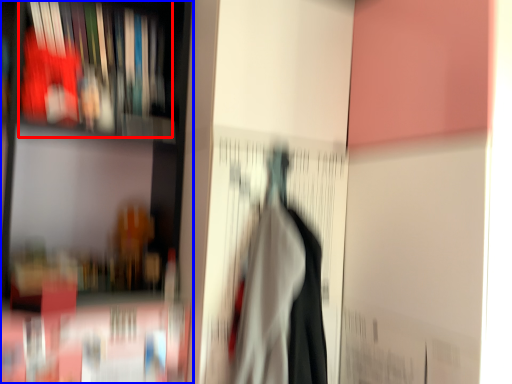
Question: Which point is further to the camera, book (highlighted by a red box) or shelf (highlighted by a blue box)?

Choices:
 (A) book
 (B) shelf

Answer: (A)